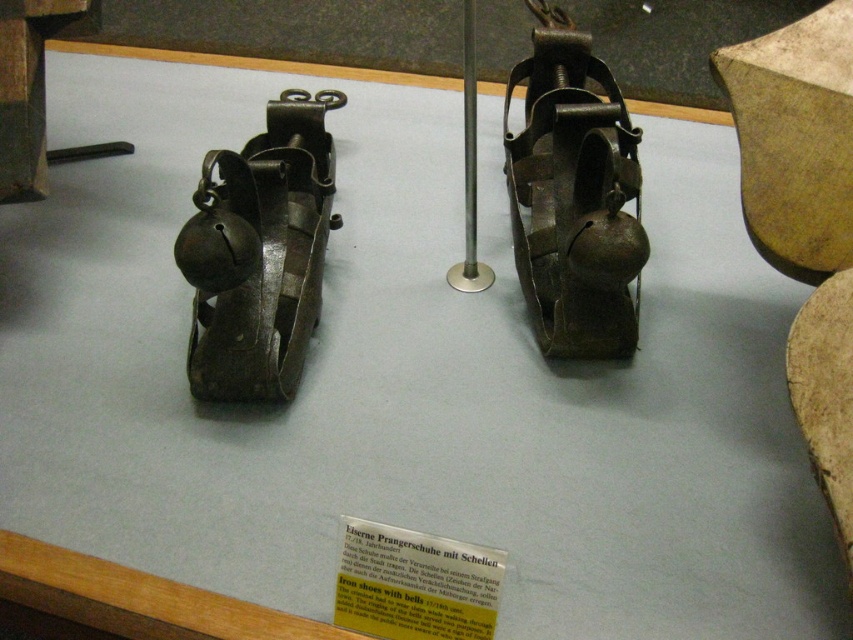
Which is behind, point (585, 241) or point (283, 253)?

Positioned behind is point (283, 253).

Which is in front, point (612, 168) or point (279, 371)?

Point (612, 168) is more forward.

Locate an element on the screen. matte metal iron shoe with bells at center is located at coordinates (573, 196).